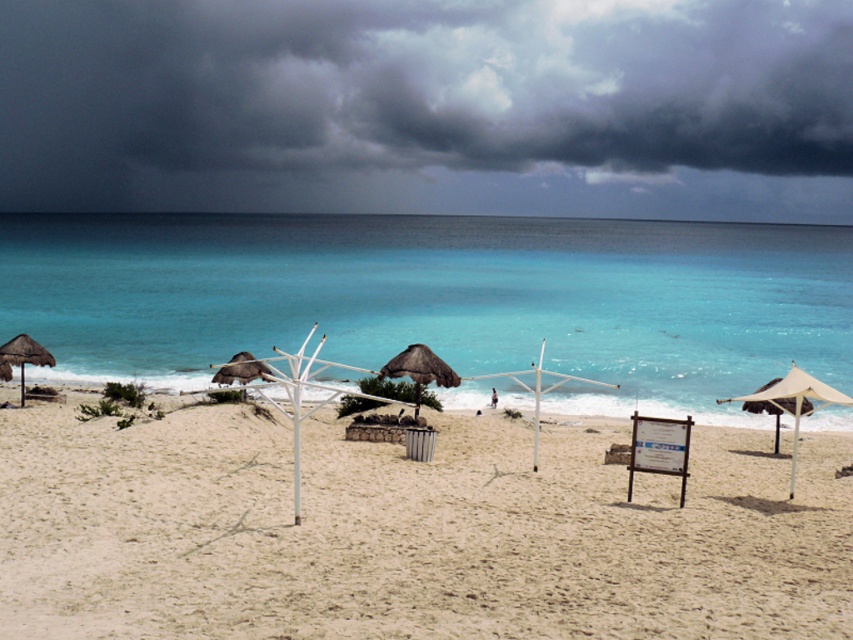
You are a beach maintenance worker who needs to place a new rectangular sign that is 2 meters wide. You have to decide between placing it on the light beige sand at center or under the beige canvas umbrella at right. Based on the space available, which location would be more suitable for the sign?

The light beige sand at center has a larger width than the beige canvas umbrella at right, so placing the 2 meter wide sign on the light beige sand at center would be more suitable as it provides enough space.

You are a beachgoer who wants to set up a picnic. You have a large picnic blanket that needs space. Which area would you choose between the light beige sand at center and the beige canvas umbrella at right?

The light beige sand at center has a larger size compared to the beige canvas umbrella at right, so you should choose the light beige sand at center for setting up your picnic blanket.

You are a visitor walking along the beach and want to reach the brown thatched umbrella at left. However, there is a brown thatched umbrella at center blocking your path. Can you walk directly to the left umbrella without going around it?

The brown thatched umbrella at center is in front of the brown thatched umbrella at left, so you cannot walk directly to the left umbrella without going around it.